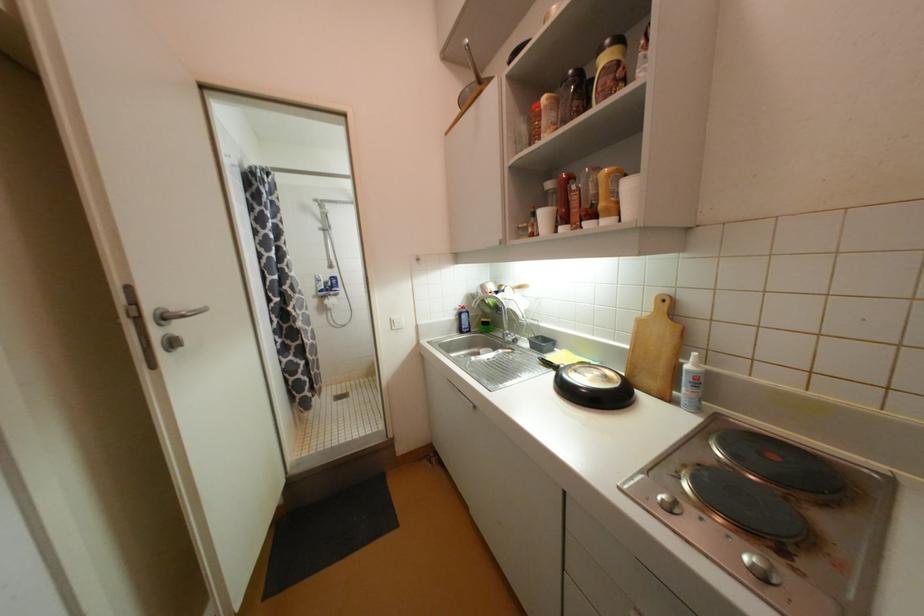
Locate an element on the screen. The width and height of the screenshot is (924, 616). silver door handle is located at coordinates (193, 312).